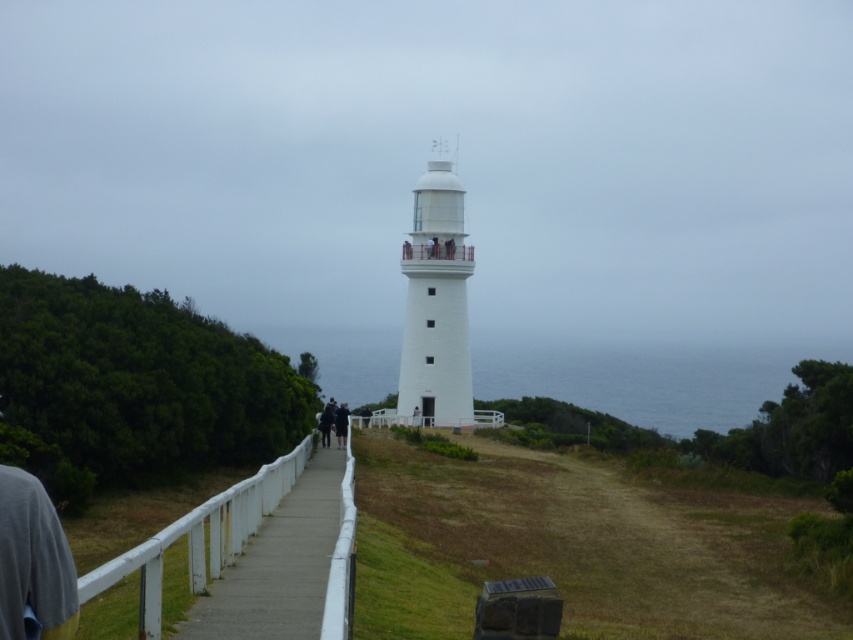
You are a photographer planning to take a picture of the white smooth tower at center and the dark gray fabric jacket at center from the base of the hill. Which object will appear larger in the photo?

The white smooth tower at center will appear larger in the photo because it is much taller than the dark gray fabric jacket at center.

You are a tour guide leading a group to the top of the white smooth tower at center. Your group has a large cart that is 3 meters wide. Can the cart pass through the white wooden path at center?

The white wooden path at center has a lesser width compared to white smooth tower at center. Since the path is narrower than the tower, and the cart is 3 meters wide, it is uncertain if the path can accommodate the cart without knowing the exact width of the path. However, the description only states the path is narrower than the tower, not its absolute size. Therefore, without specific measurements of the path itself, we cannot confirm if the cart will fit.